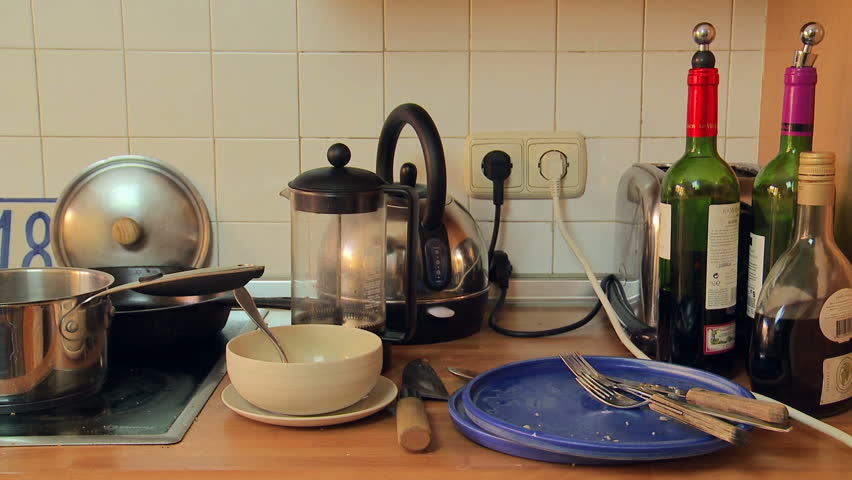
Image resolution: width=852 pixels, height=480 pixels. I want to click on kettle, so click(458, 262).